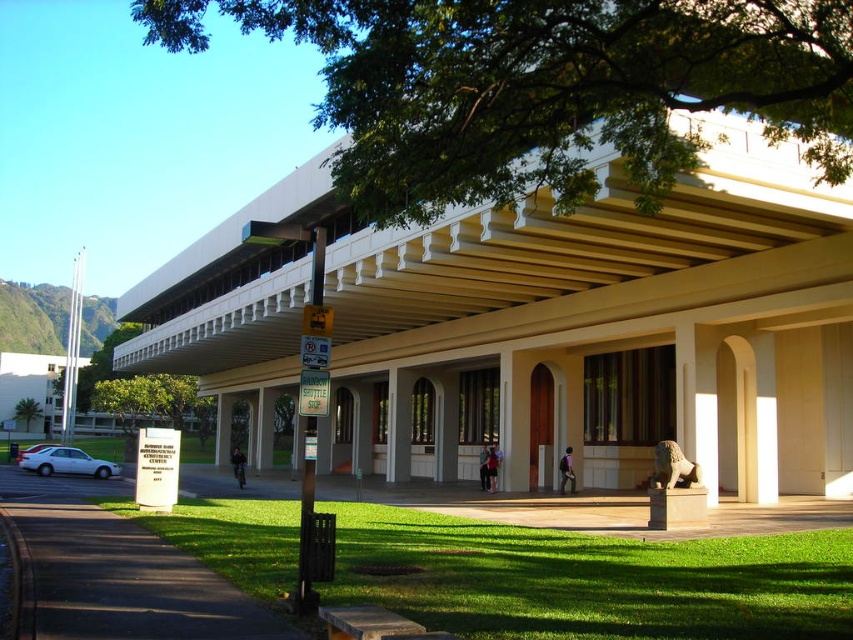
Does dark asphalt pavement at lower left have a lesser height compared to green leafy tree at lower left?

Yes.

Image resolution: width=853 pixels, height=640 pixels. I want to click on dark asphalt pavement at lower left, so click(x=125, y=580).

Does dark asphalt pavement at lower left appear under white matte sedan at lower left?

No, dark asphalt pavement at lower left is not below white matte sedan at lower left.

Between point (86, 577) and point (73, 474), which one is positioned in front?

Positioned in front is point (86, 577).

At what (x,y) coordinates should I click in order to perform the action: click on dark asphalt pavement at lower left. Please return your answer as a coordinate pair (x, y). This screenshot has width=853, height=640. Looking at the image, I should click on (125, 580).

Between white matte sedan at lower left and green leafy tree at lower left, which one has more height?

Standing taller between the two is green leafy tree at lower left.

Find the location of a particular element. white matte sedan at lower left is located at coordinates (67, 461).